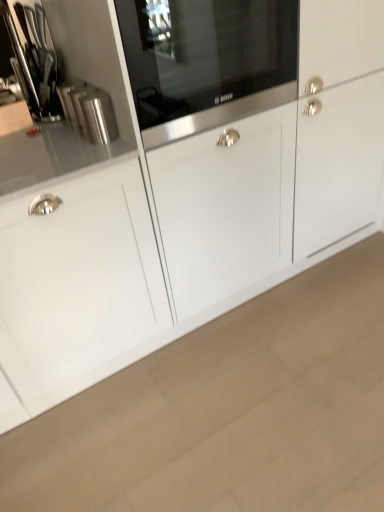
The width and height of the screenshot is (384, 512). Find the location of `polished stainless steel canister at left`. polished stainless steel canister at left is located at coordinates (x=89, y=111).

Image resolution: width=384 pixels, height=512 pixels. In order to click on stainless steel microwave at center in this screenshot , I will do `click(206, 61)`.

What is the approximate width of polished stainless steel knife block at upper left?

It is 6.73 centimeters.

Measure the distance between point (41, 28) and camera.

A distance of 1.52 meters exists between point (41, 28) and camera.

The width and height of the screenshot is (384, 512). Find the location of `polished stainless steel canister at left`. polished stainless steel canister at left is located at coordinates (89, 111).

Can you see polished stainless steel knife block at upper left touching polished stainless steel canister at left?

No, polished stainless steel knife block at upper left is not in contact with polished stainless steel canister at left.

How different are the orientations of polished stainless steel knife block at upper left and polished stainless steel canister at left in degrees?

0.00673 degrees.

Does point (29, 55) appear closer or farther from the camera than point (106, 112)?

Clearly, point (29, 55) is more distant from the camera than point (106, 112).

Which object is closer to the camera taking this photo, stainless steel microwave at center or polished stainless steel knife block at upper left?

stainless steel microwave at center.

Where is `home appliance above the polished stainless steel knife block at upper left (from a real-world perspective)`? home appliance above the polished stainless steel knife block at upper left (from a real-world perspective) is located at coordinates (206, 61).

From a real-world perspective, is stainless steel microwave at center on top of polished stainless steel knife block at upper left?

Yes, from a real-world perspective, stainless steel microwave at center is on top of polished stainless steel knife block at upper left.

How far apart are stainless steel microwave at center and polished stainless steel knife block at upper left?

A distance of 62.98 centimeters exists between stainless steel microwave at center and polished stainless steel knife block at upper left.

Choose the correct answer: Is stainless steel microwave at center inside polished stainless steel canister at left or outside it?

stainless steel microwave at center lies outside polished stainless steel canister at left.

From the image's perspective, between stainless steel microwave at center and polished stainless steel canister at left, who is located below?

polished stainless steel canister at left is shown below in the image.

What's the angular difference between stainless steel microwave at center and polished stainless steel canister at left's facing directions?

The angular difference between stainless steel microwave at center and polished stainless steel canister at left is 3.21 degrees.

From a real-world perspective, is stainless steel microwave at center located beneath polished stainless steel canister at left?

No.

Image resolution: width=384 pixels, height=512 pixels. I want to click on home appliance located in front of the polished stainless steel canister at left, so click(x=206, y=61).

From the image's perspective, is polished stainless steel canister at left over stainless steel microwave at center?

No.

Which object is closer to the camera, polished stainless steel canister at left or stainless steel microwave at center?

Positioned in front is stainless steel microwave at center.

Considering the relative sizes of polished stainless steel canister at left and polished stainless steel knife block at upper left in the image provided, is polished stainless steel canister at left bigger than polished stainless steel knife block at upper left?

No.

Where is `kitchen appliance that is below the polished stainless steel knife block at upper left (from the image's perspective)`? This screenshot has height=512, width=384. kitchen appliance that is below the polished stainless steel knife block at upper left (from the image's perspective) is located at coordinates (89, 111).

Considering the points (70, 81) and (17, 34), which point is behind, point (70, 81) or point (17, 34)?

The point (70, 81) is farther from the camera.

Is polished stainless steel canister at left not near polished stainless steel knife block at upper left?

No, polished stainless steel canister at left is in close proximity to polished stainless steel knife block at upper left.

Considering the sizes of polished stainless steel knife block at upper left and stainless steel microwave at center in the image, is polished stainless steel knife block at upper left taller or shorter than stainless steel microwave at center?

In the image, polished stainless steel knife block at upper left appears to be shorter than stainless steel microwave at center.

Looking at this image, from a real-world perspective, who is located lower, polished stainless steel knife block at upper left or stainless steel microwave at center?

polished stainless steel knife block at upper left.

From the image's perspective, is polished stainless steel knife block at upper left beneath stainless steel microwave at center?

Correct, polished stainless steel knife block at upper left appears lower than stainless steel microwave at center in the image.

Is polished stainless steel knife block at upper left completely or partially outside of stainless steel microwave at center?

Yes, polished stainless steel knife block at upper left is not within stainless steel microwave at center.

I want to click on kitchen appliance that appears below the polished stainless steel knife block at upper left (from a real-world perspective), so tap(89, 111).

Find the location of a particular element. home appliance in front of the polished stainless steel knife block at upper left is located at coordinates (206, 61).

When comparing their distances from stainless steel microwave at center, does polished stainless steel canister at left or polished stainless steel knife block at upper left seem further?

polished stainless steel knife block at upper left is positioned further to the anchor stainless steel microwave at center.

Which object lies further to the anchor point polished stainless steel knife block at upper left, stainless steel microwave at center or polished stainless steel canister at left?

stainless steel microwave at center.

Considering their positions, is polished stainless steel knife block at upper left positioned closer to stainless steel microwave at center than polished stainless steel canister at left?

Based on the image, polished stainless steel canister at left appears to be nearer to stainless steel microwave at center.

Based on their spatial positions, is polished stainless steel canister at left or stainless steel microwave at center closer to polished stainless steel knife block at upper left?

The object closer to polished stainless steel knife block at upper left is polished stainless steel canister at left.

When comparing their distances from polished stainless steel canister at left, does polished stainless steel knife block at upper left or stainless steel microwave at center seem further?

stainless steel microwave at center.

Estimate the real-world distances between objects in this image. Which object is further from polished stainless steel canister at left, stainless steel microwave at center or polished stainless steel knife block at upper left?

stainless steel microwave at center is further to polished stainless steel canister at left.

Where is `kitchen appliance between polished stainless steel knife block at upper left and stainless steel microwave at center from left to right`? kitchen appliance between polished stainless steel knife block at upper left and stainless steel microwave at center from left to right is located at coordinates (89, 111).